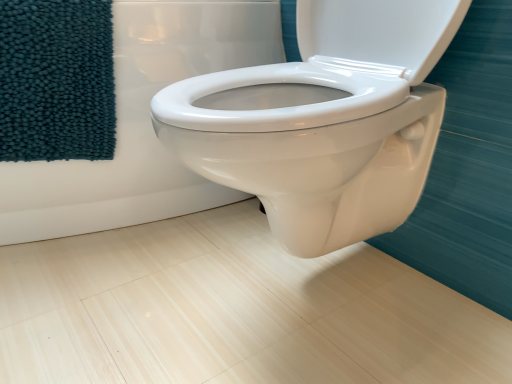
What is the approximate height of white glossy toilet at center?

21.14 inches.

The width and height of the screenshot is (512, 384). What are the coordinates of `white glossy toilet at center` in the screenshot? It's located at (141, 123).

The width and height of the screenshot is (512, 384). Describe the element at coordinates (141, 123) in the screenshot. I see `white glossy toilet at center` at that location.

Measure the distance between white glossy toilet at center and camera.

They are 36.30 inches apart.

In the scene shown: In order to face white glossy toilet at center, should I rotate leftwards or rightwards?

Turn left approximately 15.919 degrees to face it.

Locate an element on the screen. This screenshot has height=384, width=512. teal plush towel at left is located at coordinates (56, 80).

This screenshot has height=384, width=512. Describe the element at coordinates (56, 80) in the screenshot. I see `teal plush towel at left` at that location.

This screenshot has width=512, height=384. I want to click on white glossy toilet at center, so click(141, 123).

Based on their positions, is white glossy toilet at center located to the left or right of teal plush towel at left?

Clearly, white glossy toilet at center is on the right of teal plush towel at left in the image.

Between white glossy toilet at center and teal plush towel at left, which one is positioned behind?

teal plush towel at left is further away from the camera.

Is point (74, 182) positioned in front of point (74, 88)?

No, (74, 182) is behind (74, 88).

From the image's perspective, which one is positioned lower, white glossy toilet at center or teal plush towel at left?

From the image's view, teal plush towel at left is below.

From a real-world perspective, is white glossy toilet at center located beneath teal plush towel at left?

Yes, from a real-world perspective, white glossy toilet at center is beneath teal plush towel at left.

Between white glossy toilet at center and teal plush towel at left, which one has smaller width?

teal plush towel at left.

Does white glossy toilet at center have a greater height compared to teal plush towel at left?

Yes, white glossy toilet at center is taller than teal plush towel at left.

Based on their sizes in the image, would you say white glossy toilet at center is bigger or smaller than teal plush towel at left?

Considering their sizes, white glossy toilet at center takes up more space than teal plush towel at left.

Is white glossy toilet at center positioned beyond the bounds of teal plush towel at left?

white glossy toilet at center lies outside teal plush towel at left's area.

Does white glossy toilet at center touch teal plush towel at left?

They are not placed beside each other.

Is white glossy toilet at center turned away from teal plush towel at left?

No, teal plush towel at left is not at the back of white glossy toilet at center.

Can you tell me how much white glossy toilet at center and teal plush towel at left differ in facing direction?

The facing directions of white glossy toilet at center and teal plush towel at left are 25.1 degrees apart.

Measure the distance between white glossy toilet at center and teal plush towel at left.

The distance of white glossy toilet at center from teal plush towel at left is 5.38 inches.

Locate an element on the screen. The width and height of the screenshot is (512, 384). beach towel behind the white glossy toilet at center is located at coordinates (56, 80).

Between teal plush towel at left and white glossy toilet at center, which one appears on the right side from the viewer's perspective?

white glossy toilet at center.

Considering their positions, is teal plush towel at left located in front of or behind white glossy toilet at center?

In the image, teal plush towel at left appears behind white glossy toilet at center.

Considering the points (105, 42) and (46, 190), which point is behind, point (105, 42) or point (46, 190)?

Positioned behind is point (46, 190).

From the image's perspective, is teal plush towel at left on white glossy toilet at center?

No, from the image's perspective, teal plush towel at left is not above white glossy toilet at center.

From a real-world perspective, is teal plush towel at left physically located above or below white glossy toilet at center?

From a real-world perspective, teal plush towel at left is physically above white glossy toilet at center.

Which object is thinner, teal plush towel at left or white glossy toilet at center?

teal plush towel at left is thinner.

Who is taller, teal plush towel at left or white glossy toilet at center?

white glossy toilet at center.

Looking at the image, does teal plush towel at left seem bigger or smaller compared to white glossy toilet at center?

In the image, teal plush towel at left appears to be smaller than white glossy toilet at center.

Does teal plush towel at left contain white glossy toilet at center?

No, white glossy toilet at center is not surrounded by teal plush towel at left.

Is teal plush towel at left not near white glossy toilet at center?

teal plush towel at left is near white glossy toilet at center, not far away.

In the scene shown: Could you tell me if teal plush towel at left is turned towards white glossy toilet at center?

Yes, teal plush towel at left is oriented towards white glossy toilet at center.

Where is `beach towel that appears on the left of white glossy toilet at center`? The image size is (512, 384). beach towel that appears on the left of white glossy toilet at center is located at coordinates (56, 80).

Locate an element on the screen. This screenshot has height=384, width=512. beach towel behind the white glossy toilet at center is located at coordinates (56, 80).

Identify the location of bath lying in front of the teal plush towel at left. This screenshot has width=512, height=384. (141, 123).